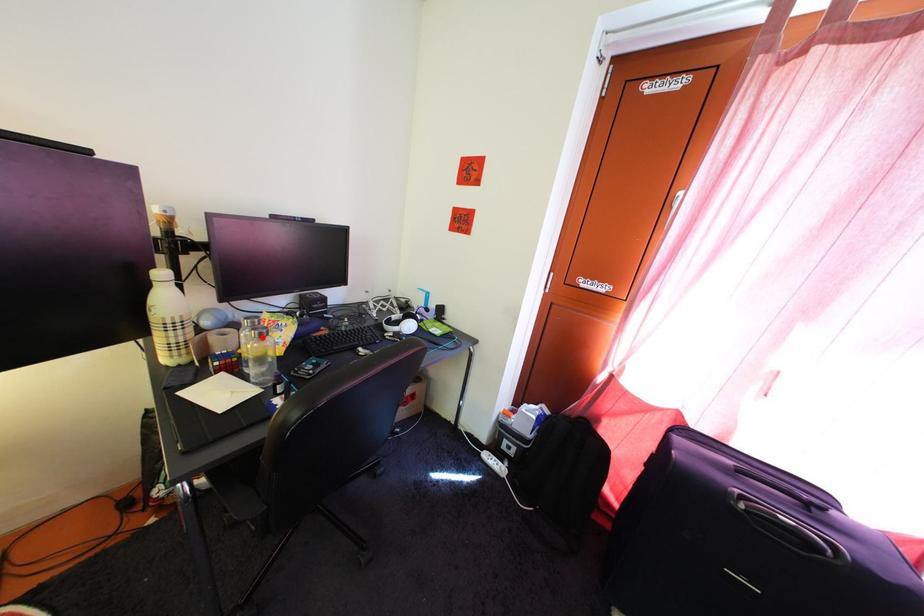
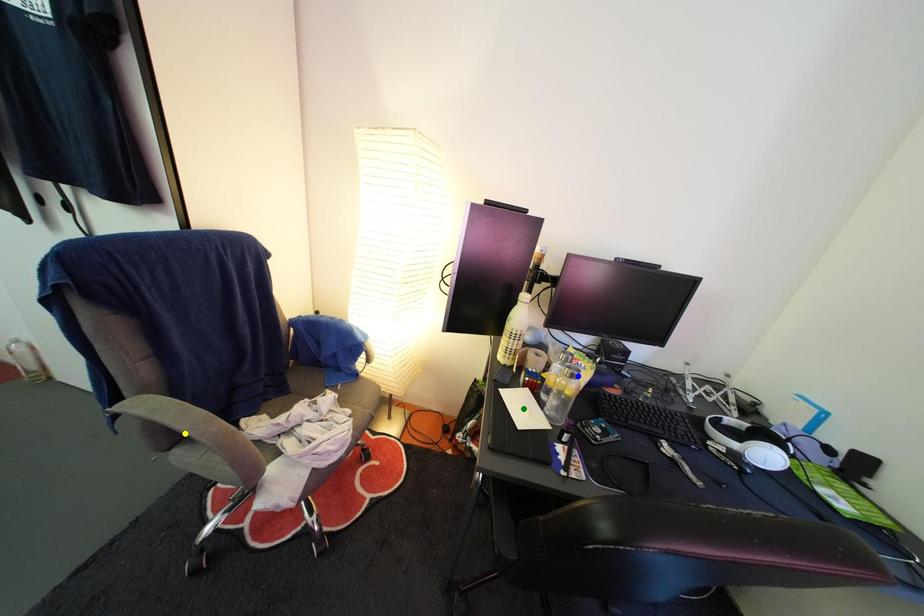
Question: I am providing you with two images of the same scene from different viewpoints. A red point is marked on the first image. You are given multiple points on the second image. In image 2, which mark is for the same physical point as the one in image 1?

Choices:
 (A) blue point
 (B) green point
 (C) yellow point

Answer: (A)